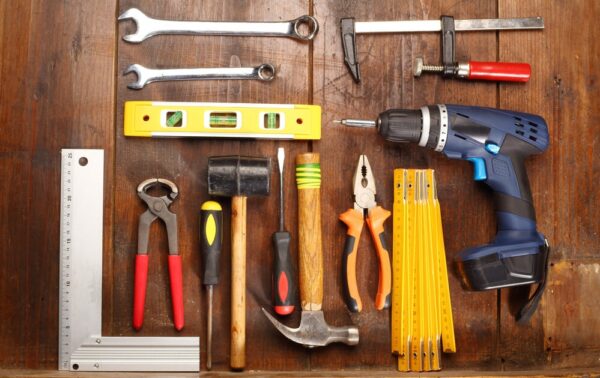
The image size is (600, 378). I want to click on old wooden paneling, so click(43, 90), click(171, 88), click(328, 95), click(465, 91), click(549, 95).